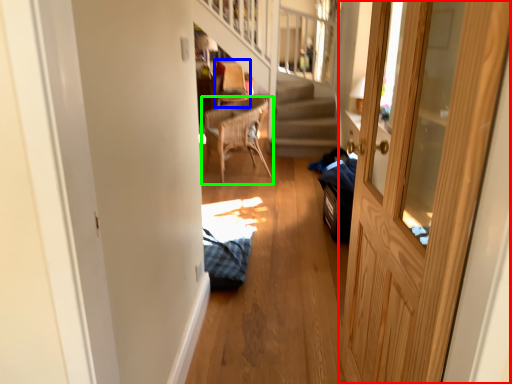
Question: Which is farther away from door (highlighted by a red box)? armchair (highlighted by a blue box) or chair (highlighted by a green box)?

Choices:
 (A) armchair
 (B) chair

Answer: (A)